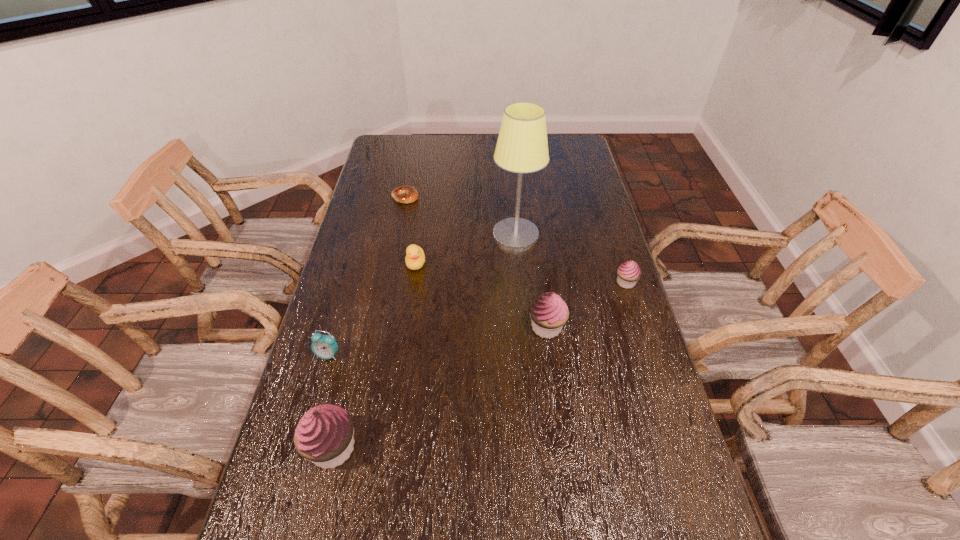
Find the location of a particular element. The width and height of the screenshot is (960, 540). vacant area that lies between the table lamp and the duckling is located at coordinates (466, 249).

The image size is (960, 540). What are the coordinates of `vacant space in between the sixth nearest object and the nearest object` in the screenshot? It's located at (424, 341).

I want to click on vacant space in between the nearest cupcake and the sixth farthest object, so click(x=330, y=401).

Identify the location of free space that is in between the nearest object and the second farthest cupcake. (440, 387).

This screenshot has width=960, height=540. Identify the location of vacant region between the nearest object and the bagel. (369, 322).

The height and width of the screenshot is (540, 960). Find the location of `vacant area that lies between the tallest object and the second shortest cupcake`. vacant area that lies between the tallest object and the second shortest cupcake is located at coordinates (531, 281).

At what (x,y) coordinates should I click in order to perform the action: click on free space between the second nearest object and the rightmost cupcake. Please return your answer as a coordinate pair (x, y). Looking at the image, I should click on (477, 319).

At what (x,y) coordinates should I click in order to perform the action: click on empty space that is in between the rightmost cupcake and the fifth shortest object. Please return your answer as a coordinate pair (x, y). The height and width of the screenshot is (540, 960). Looking at the image, I should click on (587, 305).

What are the coordinates of `free area in between the third farthest object and the bagel` in the screenshot? It's located at (411, 230).

Where is `object that ranks as the closest to the third farthest object`? The width and height of the screenshot is (960, 540). object that ranks as the closest to the third farthest object is located at coordinates (522, 147).